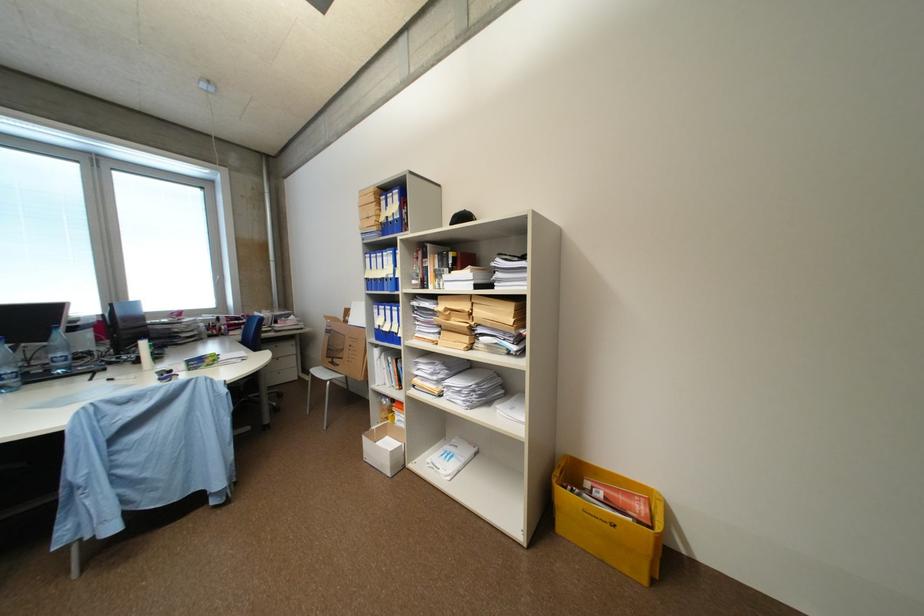
Locate an element on the screen. white cardboard box is located at coordinates (383, 448).